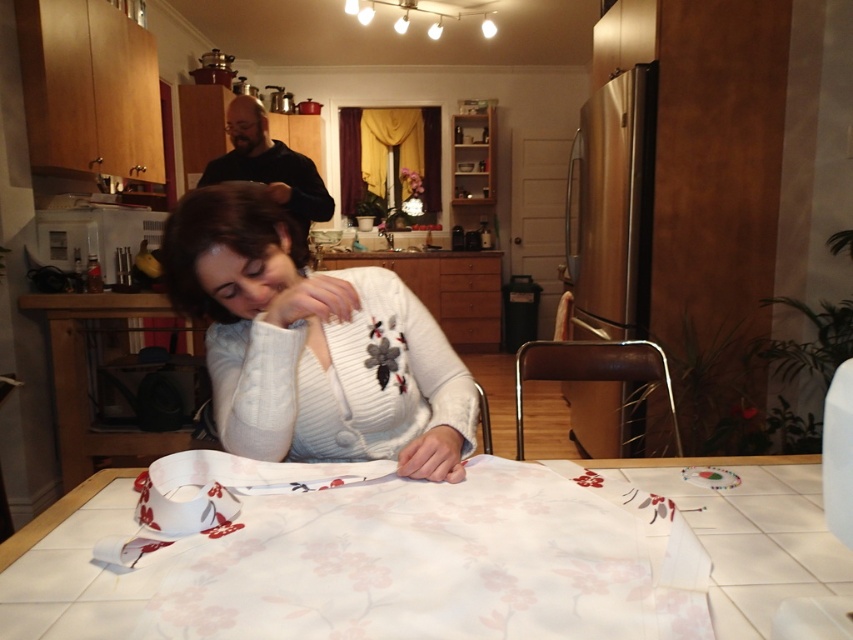
Question: Observing the image, what is the correct spatial positioning of white knit sweater at center in reference to white fabric at center?

Choices:
 (A) above
 (B) below

Answer: (A)

Question: From the image, what is the correct spatial relationship of white knit sweater at center in relation to white fabric at center?

Choices:
 (A) left
 (B) right

Answer: (A)

Question: In this image, where is white knit sweater at center located relative to white fabric at center?

Choices:
 (A) above
 (B) below

Answer: (A)